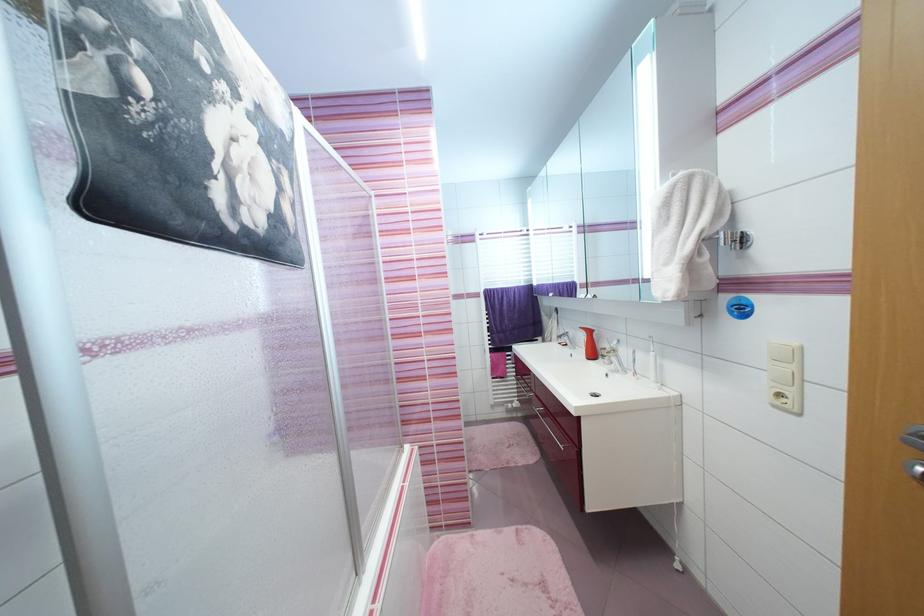
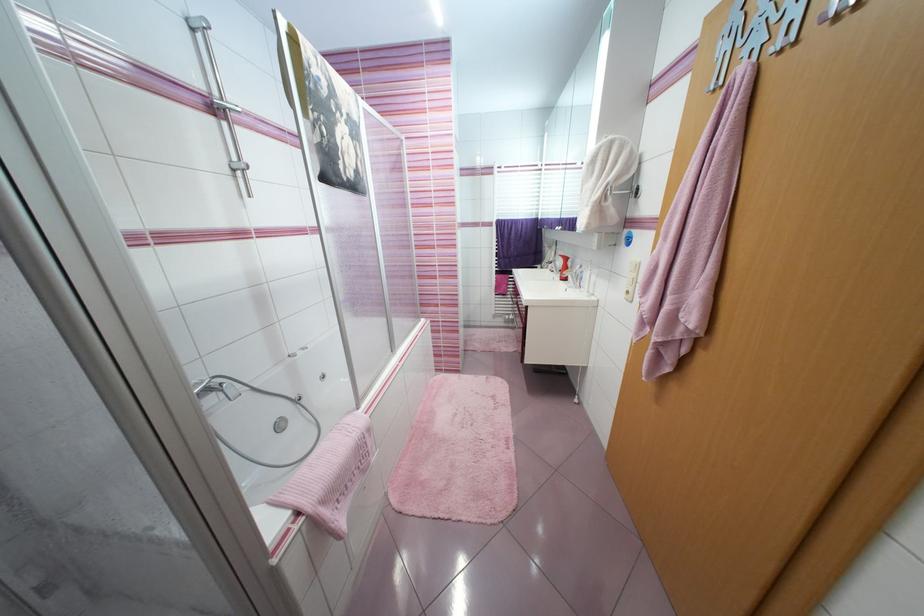
In the second image, find the point that corresponds to pixel 784 397 in the first image.

(633, 293)